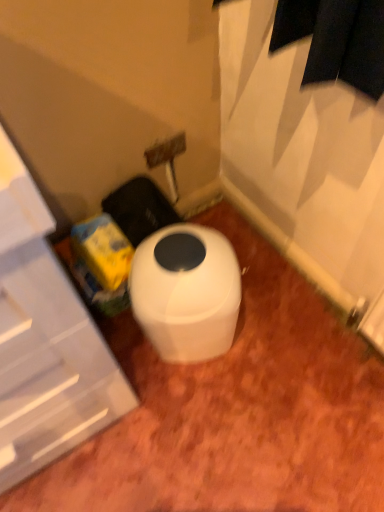
Question: Would you say white plastic cabinet at left is to the left or to the right of white glossy toilet at center in the picture?

Choices:
 (A) left
 (B) right

Answer: (A)

Question: Relative to white glossy toilet at center, is white plastic cabinet at left in front or behind?

Choices:
 (A) behind
 (B) front

Answer: (B)

Question: From a real-world perspective, is white plastic cabinet at left above or below white glossy toilet at center?

Choices:
 (A) below
 (B) above

Answer: (B)

Question: Is white glossy toilet at center inside or outside of white plastic cabinet at left?

Choices:
 (A) outside
 (B) inside

Answer: (A)

Question: Considering the relative positions of white glossy toilet at center and white plastic cabinet at left in the image provided, is white glossy toilet at center to the left or to the right of white plastic cabinet at left?

Choices:
 (A) right
 (B) left

Answer: (A)

Question: Considering the positions of point (183, 266) and point (76, 295), is point (183, 266) closer or farther from the camera than point (76, 295)?

Choices:
 (A) farther
 (B) closer

Answer: (A)

Question: From a real-world perspective, relative to white plastic cabinet at left, is white glossy toilet at center vertically above or below?

Choices:
 (A) above
 (B) below

Answer: (B)